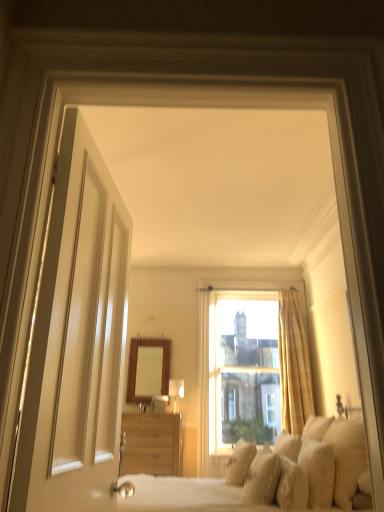
Question: From the image's perspective, is matte white lampshade at center positioned above or below white soft pillow at lower right, arranged as the 3th pillow when viewed from the right?

Choices:
 (A) below
 (B) above

Answer: (A)

Question: Would you say matte white lampshade at center is to the left or to the right of white soft pillow at lower right, the 4th pillow viewed from the left, in the picture?

Choices:
 (A) right
 (B) left

Answer: (B)

Question: Estimate the real-world distances between objects in this image. Which object is closer to the white glossy door at left?

Choices:
 (A) clear glass window at center
 (B) soft white pillow at lower right, the sixth pillow positioned from the left
 (C) matte white lampshade at center
 (D) wooden cabinet at lower center
 (E) beige fabric curtain at right

Answer: (B)

Question: Which is farther from the soft beige pillow at lower right, placed as the fifth pillow when sorted from right to left?

Choices:
 (A) beige fabric curtain at right
 (B) white soft pillow at lower right, arranged as the 3th pillow when viewed from the right
 (C) fluffy white pillow at lower right, which is counted as the 4th pillow, starting from the right
 (D) soft cream pillows at center
 (E) clear glass window at center

Answer: (E)